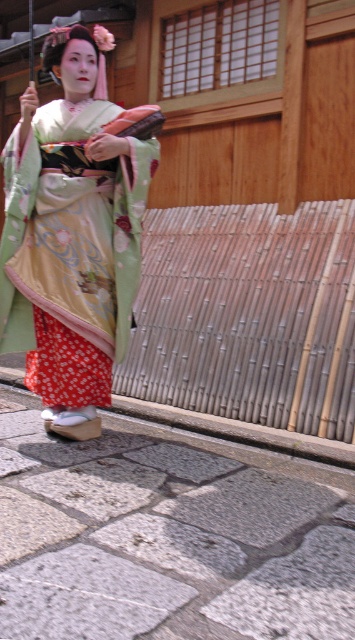
Does gray stone pavement at lower center come behind silky green kimono at center?

No, it is in front of silky green kimono at center.

This screenshot has height=640, width=355. I want to click on gray stone pavement at lower center, so click(x=165, y=540).

Identify the location of gray stone pavement at lower center. (165, 540).